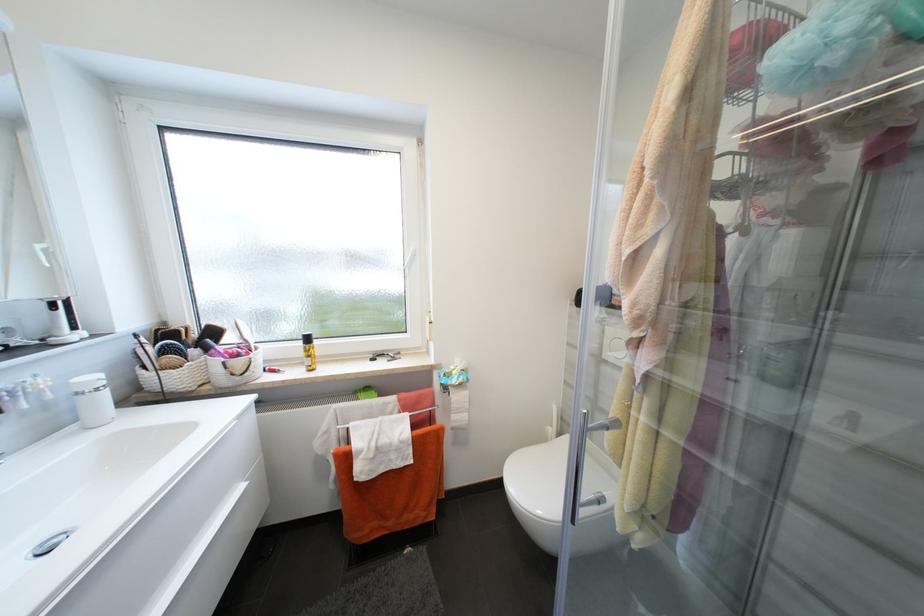
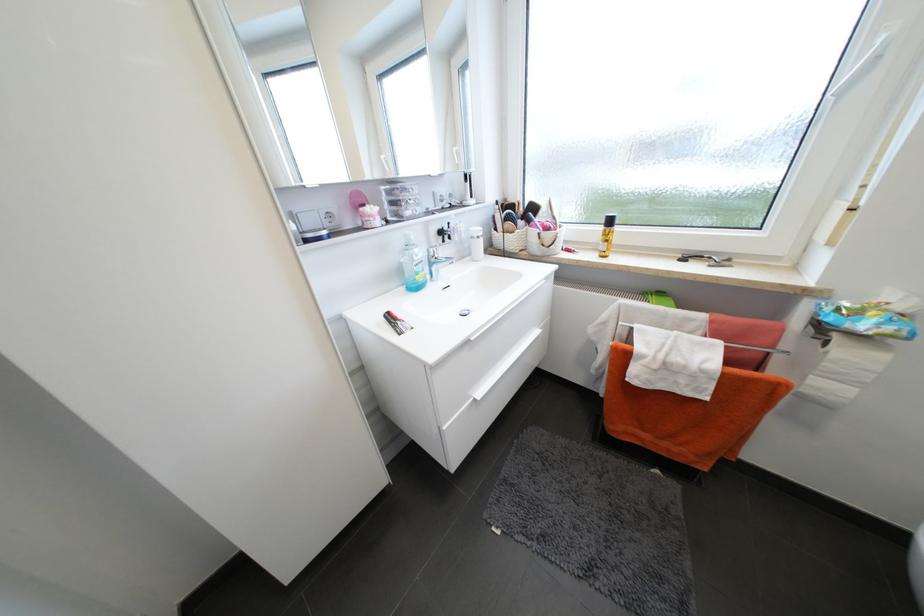
Where in the second image is the point corresponding to the point at 310,371 from the first image?

(602, 256)